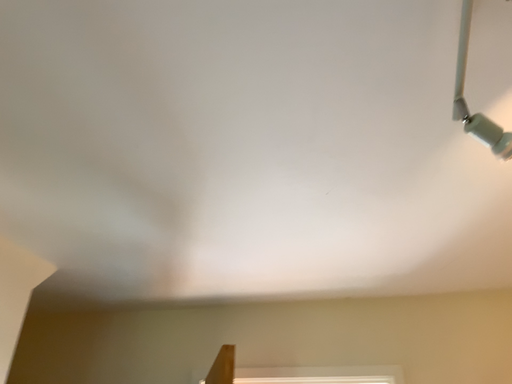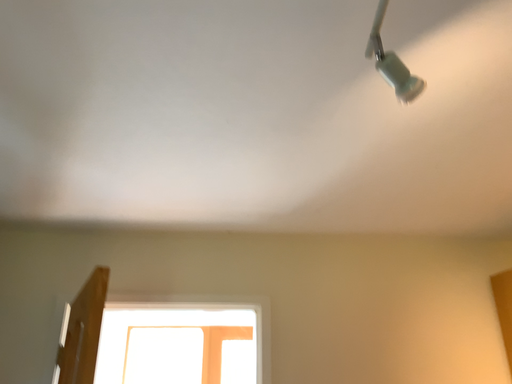
Question: How did the camera likely rotate when shooting the video?

Choices:
 (A) rotated downward
 (B) rotated upward

Answer: (A)